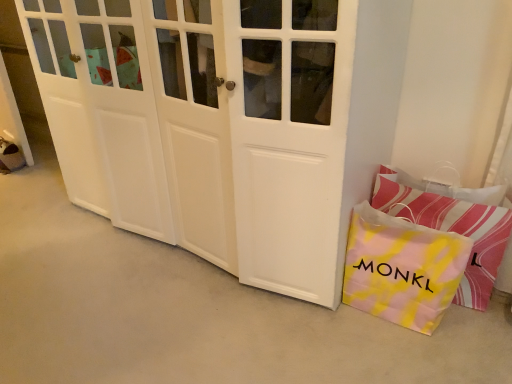
The image size is (512, 384). What do you see at coordinates (247, 126) in the screenshot?
I see `white matte door at center` at bounding box center [247, 126].

I want to click on yellow tie-dye paper bag at lower right, so click(x=402, y=268).

The image size is (512, 384). What do you see at coordinates (452, 229) in the screenshot?
I see `pink striped pillow at lower right` at bounding box center [452, 229].

Image resolution: width=512 pixels, height=384 pixels. Find the location of `white matte door at center`. white matte door at center is located at coordinates (247, 126).

Is pink striped pillow at lower right outside of yellow tie-dye paper bag at lower right?

Yes, pink striped pillow at lower right is outside of yellow tie-dye paper bag at lower right.

Could you tell me if pink striped pillow at lower right is turned towards yellow tie-dye paper bag at lower right?

Yes.

Based on the photo, which is less distant, [391,212] or [390,287]?

Point [391,212] appears to be closer to the viewer than point [390,287].

Are pink striped pillow at lower right and yellow tie-dye paper bag at lower right beside each other?

pink striped pillow at lower right and yellow tie-dye paper bag at lower right are clearly separated.

Could you tell me if pink striped pillow at lower right is turned towards white matte door at center?

No, pink striped pillow at lower right is not facing towards white matte door at center.

Does pink striped pillow at lower right have a greater height compared to white matte door at center?

In fact, pink striped pillow at lower right may be shorter than white matte door at center.

From the image's perspective, is pink striped pillow at lower right over white matte door at center?

No, from the image's perspective, pink striped pillow at lower right is not above white matte door at center.

Is white matte door at center located outside pink striped pillow at lower right?

white matte door at center lies outside pink striped pillow at lower right's area.

Which object is positioned more to the left, white matte door at center or pink striped pillow at lower right?

white matte door at center.

Considering the positions of objects white matte door at center and pink striped pillow at lower right in the image provided, who is in front, white matte door at center or pink striped pillow at lower right?

white matte door at center is more forward.

Is yellow tie-dye paper bag at lower right positioned behind white matte door at center?

Yes, it is behind white matte door at center.

How far apart are yellow tie-dye paper bag at lower right and white matte door at center?

A distance of 17.10 inches exists between yellow tie-dye paper bag at lower right and white matte door at center.

Which is less distant, (376, 272) or (217, 160)?

Point (376, 272).

Which of these two, yellow tie-dye paper bag at lower right or white matte door at center, is smaller?

yellow tie-dye paper bag at lower right is smaller.

Is white matte door at center taller than yellow tie-dye paper bag at lower right?

Yes.

Can you tell me how much white matte door at center and yellow tie-dye paper bag at lower right differ in facing direction?

1.44 degrees separate the facing orientations of white matte door at center and yellow tie-dye paper bag at lower right.

Between white matte door at center and yellow tie-dye paper bag at lower right, which one appears on the right side from the viewer's perspective?

yellow tie-dye paper bag at lower right is more to the right.

Is yellow tie-dye paper bag at lower right aimed at pink striped pillow at lower right?

Yes, yellow tie-dye paper bag at lower right faces towards pink striped pillow at lower right.

Considering the positions of objects yellow tie-dye paper bag at lower right and pink striped pillow at lower right in the image provided, who is behind, yellow tie-dye paper bag at lower right or pink striped pillow at lower right?

pink striped pillow at lower right is further from the camera.

Considering the positions of point (410, 220) and point (488, 274), is point (410, 220) closer or farther from the camera than point (488, 274)?

Point (410, 220) is positioned closer to the camera compared to point (488, 274).

Identify the location of pillow on the right of yellow tie-dye paper bag at lower right. Image resolution: width=512 pixels, height=384 pixels. (452, 229).

In the image, there is a white matte door at center. Where is `pillow below it (from a real-world perspective)`? pillow below it (from a real-world perspective) is located at coordinates (452, 229).

Estimate the real-world distances between objects in this image. Which object is further from pink striped pillow at lower right, white matte door at center or yellow tie-dye paper bag at lower right?

white matte door at center.

From the picture: When comparing their distances from white matte door at center, does pink striped pillow at lower right or yellow tie-dye paper bag at lower right seem further?

pink striped pillow at lower right is further to white matte door at center.

Looking at this image, considering their positions, is white matte door at center positioned closer to yellow tie-dye paper bag at lower right than pink striped pillow at lower right?

pink striped pillow at lower right is positioned closer to the anchor yellow tie-dye paper bag at lower right.

From the image, which object appears to be farther from yellow tie-dye paper bag at lower right, pink striped pillow at lower right or white matte door at center?

white matte door at center is further to yellow tie-dye paper bag at lower right.

Considering their positions, is yellow tie-dye paper bag at lower right positioned closer to white matte door at center than pink striped pillow at lower right?

Based on the image, yellow tie-dye paper bag at lower right appears to be nearer to white matte door at center.

Estimate the real-world distances between objects in this image. Which object is closer to pink striped pillow at lower right, yellow tie-dye paper bag at lower right or white matte door at center?

yellow tie-dye paper bag at lower right is closer to pink striped pillow at lower right.

Locate an element on the screen. Image resolution: width=512 pixels, height=384 pixels. gift bag between white matte door at center and pink striped pillow at lower right in the horizontal direction is located at coordinates tap(402, 268).